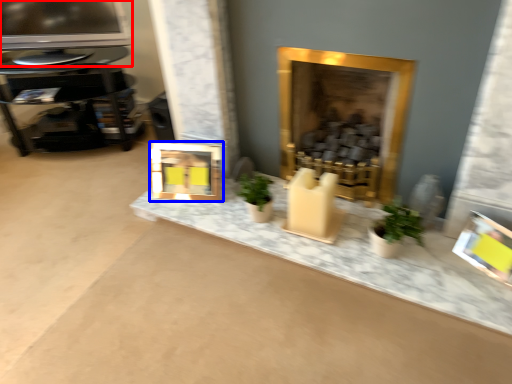
Question: Among these objects, which one is farthest to the camera, television (highlighted by a red box) or picture frame (highlighted by a blue box)?

Choices:
 (A) television
 (B) picture frame

Answer: (A)